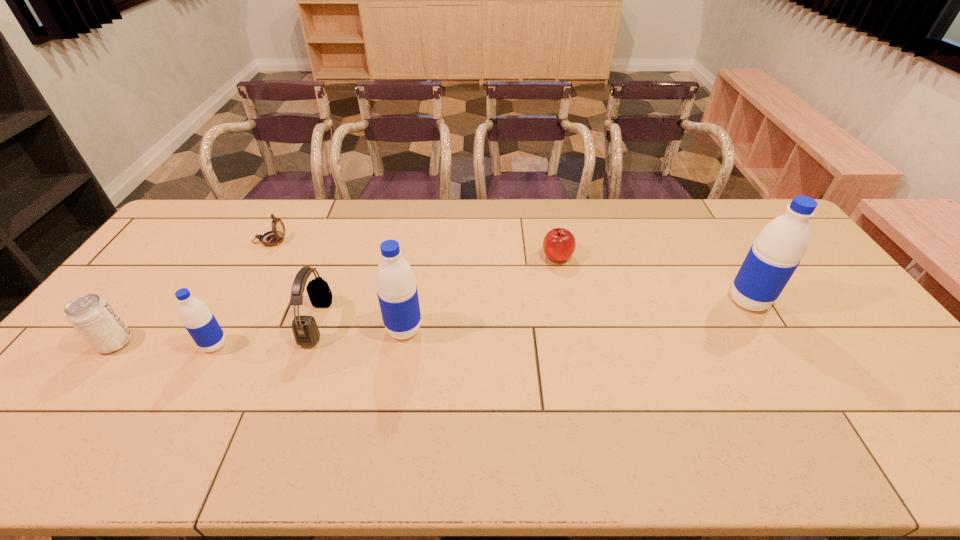
I want to click on vacant space at the right edge of the desktop, so click(x=914, y=383).

At what (x,y) coordinates should I click in order to perform the action: click on unoccupied position between the fourth object from right to left and the second water bottle from right to left. Please return your answer as a coordinate pair (x, y). Looking at the image, I should click on (360, 326).

Locate an element on the screen. vacant area between the compass and the leftmost water bottle is located at coordinates (242, 293).

At what (x,y) coordinates should I click in order to perform the action: click on vacant space in between the compass and the leftmost object. Please return your answer as a coordinate pair (x, y). The image size is (960, 540). Looking at the image, I should click on (192, 292).

You are a GUI agent. You are given a task and a screenshot of the screen. Output one action in this format:
    pyautogui.click(x=<x>, y=<y>)
    Task: Click on the unoccupied area between the fourth object from right to left and the second object from right to left
    Image resolution: width=960 pixels, height=540 pixels.
    Given the screenshot: What is the action you would take?
    pyautogui.click(x=437, y=289)

Find the location of a particular element. empty location between the fifth tallest object and the second tallest object is located at coordinates (259, 336).

Where is `vacant space in between the rightmost object and the second tallest object`? The height and width of the screenshot is (540, 960). vacant space in between the rightmost object and the second tallest object is located at coordinates (576, 315).

The height and width of the screenshot is (540, 960). I want to click on unoccupied position between the headset and the rightmost object, so click(533, 312).

Locate an element on the screen. empty location between the rightmost water bottle and the apple is located at coordinates tap(653, 279).

The height and width of the screenshot is (540, 960). In order to click on free space between the sixth object from left to right and the rightmost water bottle in this screenshot , I will do `click(653, 279)`.